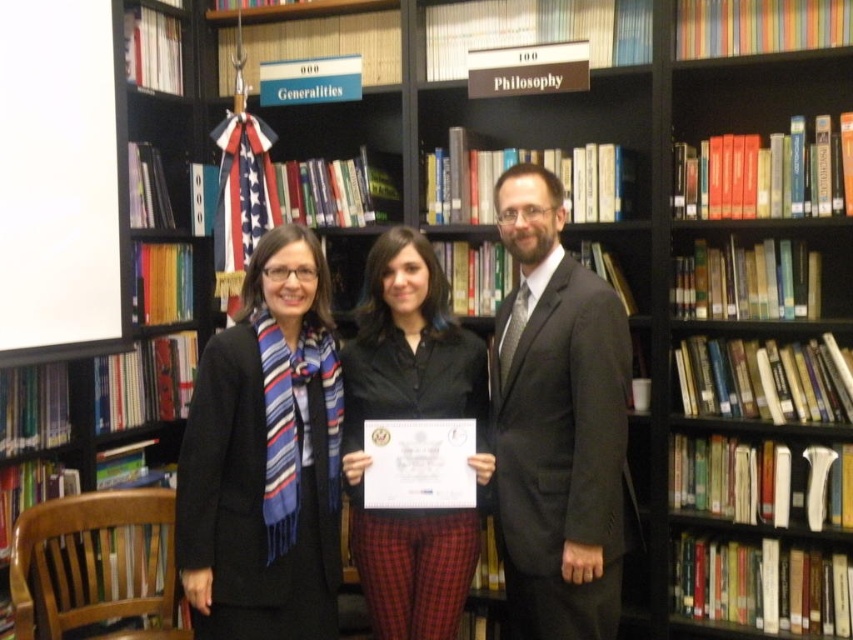
Consider the image. Between dark gray suit at center and black matte shirt at center, which one is positioned lower?

Positioned lower is black matte shirt at center.

Is dark gray suit at center bigger than black matte shirt at center?

Correct, dark gray suit at center is larger in size than black matte shirt at center.

Describe the element at coordinates (556, 422) in the screenshot. I see `dark gray suit at center` at that location.

You are a GUI agent. You are given a task and a screenshot of the screen. Output one action in this format:
    pyautogui.click(x=<x>, y=<y>)
    Task: Click on the dark gray suit at center
    
    Given the screenshot: What is the action you would take?
    pyautogui.click(x=556, y=422)

Is blue striped scarf at center above dark gray suit at center?

No.

Between point (271, 497) and point (544, 596), which one is positioned behind?

The point (544, 596) is more distant.

Identify the location of blue striped scarf at center. (265, 458).

Is blue striped scarf at center positioned before black matte shirt at center?

That is True.

Is point (270, 513) behind point (370, 275)?

No, (270, 513) is closer to viewer.

In order to click on blue striped scarf at center in this screenshot , I will do `click(265, 458)`.